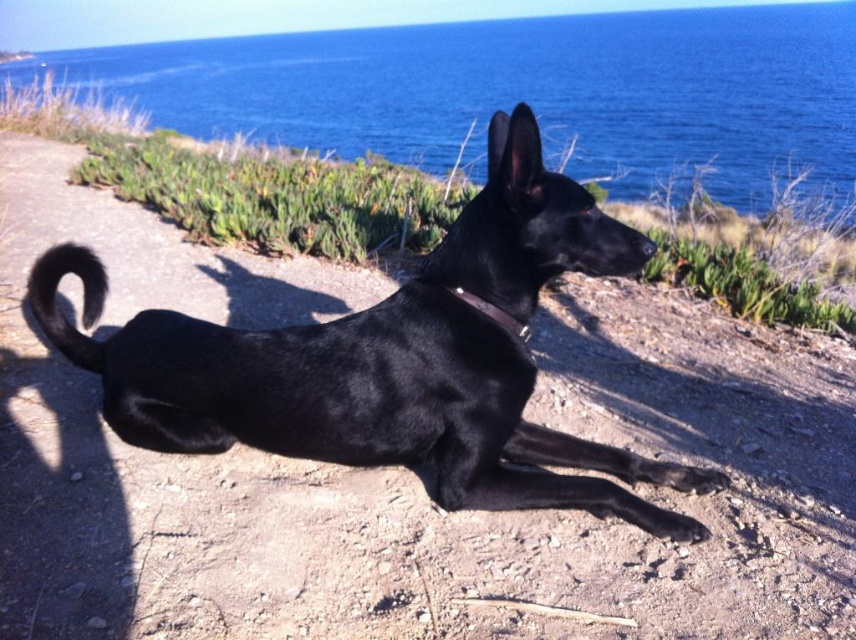
You are a photographer standing at the edge of the dirt path where the black dog is resting. You want to take a photo that includes both the blue water at upper center and the metallic silver neckband at center. Given that your camera has a maximum focus range of 10 meters, will you be able to capture both objects in focus simultaneously?

The blue water at upper center and the metallic silver neckband at center are 12.44 meters apart. Since your camera can only focus within 10 meters, the distance between them exceeds the maximum focus range. Therefore, you cannot capture both objects in focus at the same time.

From the picture: You are a photographer wanting to capture the black smooth dog at center and the blue water at upper center in a single frame. Given that your camera can only focus on objects wider than 1 meter, can both subjects be captured clearly?

The black smooth dog at center has a width less than the blue water at upper center. Since the camera requires objects wider than 1 meter to focus, if the blue water at upper center is wider than 1 meter, it can be focused, but the black smooth dog at center may be too narrow to focus on. However, without exact measurements, it is uncertain if both meet the requirement.

You are a photographer positioned at the center of the image. You want to capture a closeup shot of the black smooth dog at center. Based on its current position, which direction should you move your camera to ensure the dog is centered in your viewfinder?

The black smooth dog at center is already positioned at the center of the image coordinates at point (x=391, y=358), so the photographer does not need to move the camera to center it. The coordinates suggest it is already near the center, so minor adjustments might be needed if precise centering is required.